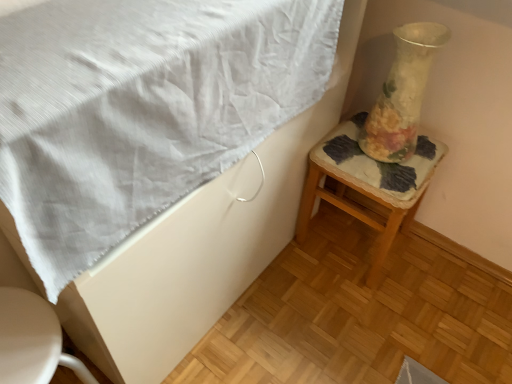
Question: Can you confirm if translucent glass vase at right is bigger than white glossy toilet at lower left?

Choices:
 (A) yes
 (B) no

Answer: (B)

Question: Would you say translucent glass vase at right is outside white glossy toilet at lower left?

Choices:
 (A) no
 (B) yes

Answer: (B)

Question: Does translucent glass vase at right have a lesser width compared to white glossy toilet at lower left?

Choices:
 (A) yes
 (B) no

Answer: (A)

Question: Considering the relative positions of translucent glass vase at right and white glossy toilet at lower left in the image provided, is translucent glass vase at right in front of white glossy toilet at lower left?

Choices:
 (A) no
 (B) yes

Answer: (A)

Question: Does translucent glass vase at right have a greater width compared to white glossy toilet at lower left?

Choices:
 (A) yes
 (B) no

Answer: (B)

Question: In the image, is white textured blanket at upper left on the left side or the right side of wooden stool with floral cushion at right?

Choices:
 (A) right
 (B) left

Answer: (B)

Question: Would you say white textured blanket at upper left is inside or outside wooden stool with floral cushion at right?

Choices:
 (A) outside
 (B) inside

Answer: (A)

Question: Is white textured blanket at upper left taller or shorter than wooden stool with floral cushion at right?

Choices:
 (A) tall
 (B) short

Answer: (B)

Question: From the image's perspective, is white textured blanket at upper left positioned above or below wooden stool with floral cushion at right?

Choices:
 (A) above
 (B) below

Answer: (A)

Question: Based on their positions, is white textured blanket at upper left located to the left or right of white glossy toilet at lower left?

Choices:
 (A) left
 (B) right

Answer: (B)

Question: Considering the positions of point (23, 67) and point (60, 360), is point (23, 67) closer or farther from the camera than point (60, 360)?

Choices:
 (A) closer
 (B) farther

Answer: (A)

Question: Is white textured blanket at upper left inside the boundaries of white glossy toilet at lower left, or outside?

Choices:
 (A) outside
 (B) inside

Answer: (A)

Question: Considering the positions of white textured blanket at upper left and white glossy toilet at lower left in the image, is white textured blanket at upper left taller or shorter than white glossy toilet at lower left?

Choices:
 (A) short
 (B) tall

Answer: (A)

Question: Looking at the image, does translucent glass vase at right seem bigger or smaller compared to white glossy toilet at lower left?

Choices:
 (A) small
 (B) big

Answer: (A)

Question: Is translucent glass vase at right in front of or behind white glossy toilet at lower left in the image?

Choices:
 (A) behind
 (B) front

Answer: (A)